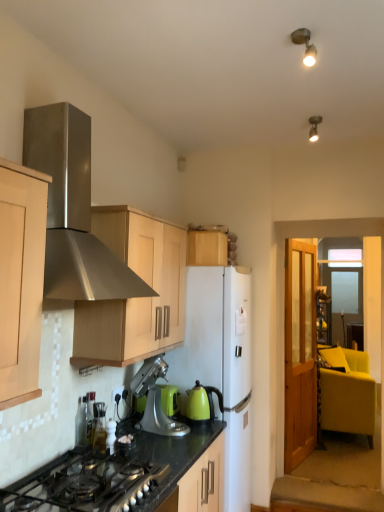
Find the location of a particular element. This screenshot has width=384, height=512. black matte gas stove at lower left is located at coordinates (84, 484).

I want to click on matte yellow armchair at right, so click(x=348, y=393).

Describe the element at coordinates (169, 399) in the screenshot. I see `green plastic kettle at center, which is the first appliance from right to left` at that location.

This screenshot has height=512, width=384. Describe the element at coordinates (206, 248) in the screenshot. I see `light wood cabinet at upper center, the 2th cabinetry in the left-to-right sequence` at that location.

Locate an element on the screen. The width and height of the screenshot is (384, 512). white matte refrigerator at center is located at coordinates (x=215, y=333).

What do you see at coordinates (99, 426) in the screenshot? This screenshot has height=512, width=384. I see `clear glass bottle at center, which ranks as the third appliance in back-to-front order` at bounding box center [99, 426].

Identify the location of black matte gas stove at lower left. Image resolution: width=384 pixels, height=512 pixels. (84, 484).

From the picture: Could you measure the distance between black granite countertop at lower center and green plastic kettle at center, which is the first appliance from right to left?

The distance of black granite countertop at lower center from green plastic kettle at center, which is the first appliance from right to left, is 23.24 inches.

In the scene shown: Is black granite countertop at lower center in contact with green plastic kettle at center, the third appliance viewed from the front?

black granite countertop at lower center is not next to green plastic kettle at center, the third appliance viewed from the front, and they're not touching.

From the image's perspective, is black granite countertop at lower center on top of green plastic kettle at center, positioned as the third appliance in left-to-right order?

No, from the image's perspective, black granite countertop at lower center is not on top of green plastic kettle at center, positioned as the third appliance in left-to-right order.

From their relative heights in the image, would you say black granite countertop at lower center is taller or shorter than green plastic kettle at center, the first appliance viewed from the back?

black granite countertop at lower center is taller than green plastic kettle at center, the first appliance viewed from the back.

From the image's perspective, which one is positioned higher, matte silver spotlight at upper center, which is the first light fixture in right-to-left order, or light wood cabinet at upper center, the 2th cabinetry in the left-to-right sequence?

A: matte silver spotlight at upper center, which is the first light fixture in right-to-left order, is shown above in the image.

Is matte silver spotlight at upper center, the second light fixture when ordered from left to right, facing towards light wood cabinet at upper center, the 2th cabinetry in the left-to-right sequence?

No, matte silver spotlight at upper center, the second light fixture when ordered from left to right, is not aimed at light wood cabinet at upper center, the 2th cabinetry in the left-to-right sequence.

In the scene shown: How different are the orientations of matte silver spotlight at upper center, the 2th light fixture positioned from the front, and light wood cabinet at upper center, the 2th cabinetry in the left-to-right sequence, in degrees?

matte silver spotlight at upper center, the 2th light fixture positioned from the front, and light wood cabinet at upper center, the 2th cabinetry in the left-to-right sequence, are facing 96.4 degrees away from each other.

Does matte silver spotlight at upper center, which is the first light fixture in right-to-left order, have a smaller size compared to light wood cabinet at upper center, marked as the first cabinetry in a right-to-left arrangement?

Correct, matte silver spotlight at upper center, which is the first light fixture in right-to-left order, occupies less space than light wood cabinet at upper center, marked as the first cabinetry in a right-to-left arrangement.

Considering the sizes of objects matte silver spotlight at upper center, the second light fixture when ordered from left to right, and metallic spot light at upper right, which is the first light fixture in front-to-back order, in the image provided, who is shorter, matte silver spotlight at upper center, the second light fixture when ordered from left to right, or metallic spot light at upper right, which is the first light fixture in front-to-back order,?

With less height is matte silver spotlight at upper center, the second light fixture when ordered from left to right.

How far apart are matte silver spotlight at upper center, the 2th light fixture positioned from the front, and metallic spot light at upper right, the 2th light fixture positioned from the right?

matte silver spotlight at upper center, the 2th light fixture positioned from the front, is 33.47 inches away from metallic spot light at upper right, the 2th light fixture positioned from the right.

From the image's perspective, would you say matte silver spotlight at upper center, the 2th light fixture positioned from the front, is shown under metallic spot light at upper right, which is the first light fixture in front-to-back order?

Indeed, from the image's perspective, matte silver spotlight at upper center, the 2th light fixture positioned from the front, is shown beneath metallic spot light at upper right, which is the first light fixture in front-to-back order.

From a real-world perspective, is matte silver spotlight at upper center, which is the first light fixture in right-to-left order, physically located above or below metallic spot light at upper right, positioned as the second light fixture in back-to-front order?

matte silver spotlight at upper center, which is the first light fixture in right-to-left order, is situated lower than metallic spot light at upper right, positioned as the second light fixture in back-to-front order, in the real world.

Starting from the black granite countertop at lower center, which appliance is the 2nd one to the left? Please provide its 2D coordinates.

[(99, 426)]

Considering the relative sizes of black granite countertop at lower center and clear glass bottle at center, acting as the first appliance starting from the front, in the image provided, is black granite countertop at lower center shorter than clear glass bottle at center, acting as the first appliance starting from the front,?

In fact, black granite countertop at lower center may be taller than clear glass bottle at center, acting as the first appliance starting from the front.

Measure the distance between black granite countertop at lower center and clear glass bottle at center, the 2th appliance viewed from the right.

The distance of black granite countertop at lower center from clear glass bottle at center, the 2th appliance viewed from the right, is 14.94 inches.

Between black granite countertop at lower center and clear glass bottle at center, which ranks as the third appliance in back-to-front order, which one has smaller width?

clear glass bottle at center, which ranks as the third appliance in back-to-front order.

Where is `countertop located in front of the matte silver spotlight at upper center, which is counted as the first light fixture, starting from the back`? Image resolution: width=384 pixels, height=512 pixels. countertop located in front of the matte silver spotlight at upper center, which is counted as the first light fixture, starting from the back is located at coordinates (129, 477).

Which object is positioned more to the right, black granite countertop at lower center or matte silver spotlight at upper center, the 2th light fixture positioned from the front?

matte silver spotlight at upper center, the 2th light fixture positioned from the front, is more to the right.

Between black granite countertop at lower center and matte silver spotlight at upper center, which is counted as the first light fixture, starting from the back, which one has smaller width?

matte silver spotlight at upper center, which is counted as the first light fixture, starting from the back.

Is black granite countertop at lower center touching matte silver spotlight at upper center, the second light fixture when ordered from left to right?

No, black granite countertop at lower center is not beside matte silver spotlight at upper center, the second light fixture when ordered from left to right.

Locate an element on the screen. the 1st appliance positioned below the stainless steel range hood at upper left (from the image's perspective) is located at coordinates (83, 423).

Can you confirm if stainless steel range hood at upper left is positioned to the left of brushed metal toaster at lower left, marked as the 1th appliance in a left-to-right arrangement?

No, stainless steel range hood at upper left is not to the left of brushed metal toaster at lower left, marked as the 1th appliance in a left-to-right arrangement.

Considering the points (72, 243) and (79, 438), which point is in front, point (72, 243) or point (79, 438)?

The point (72, 243) is in front.

You are a GUI agent. You are given a task and a screenshot of the screen. Output one action in this format:
    pyautogui.click(x=<x>, y=<y>)
    Task: Click on the 1st cabinetry to the right of the stainless steel range hood at upper left, counting from the anchor's position
    
    Given the screenshot: What is the action you would take?
    pyautogui.click(x=134, y=298)

Looking at this image, considering the relative positions of stainless steel range hood at upper left and light wood cabinet at upper center, the second cabinetry in the right-to-left sequence, in the image provided, is stainless steel range hood at upper left to the left of light wood cabinet at upper center, the second cabinetry in the right-to-left sequence, from the viewer's perspective?

Indeed, stainless steel range hood at upper left is positioned on the left side of light wood cabinet at upper center, the second cabinetry in the right-to-left sequence.

How many degrees apart are the facing directions of stainless steel range hood at upper left and light wood cabinet at upper center, the 1th cabinetry positioned from the left?

0.315 degrees separate the facing orientations of stainless steel range hood at upper left and light wood cabinet at upper center, the 1th cabinetry positioned from the left.

From the image's perspective, is stainless steel range hood at upper left located beneath light wood cabinet at upper center, the second cabinetry in the right-to-left sequence?

No.

There is a black granite countertop at lower center. Identify the location of the 1st appliance above it (from a real-world perspective). This screenshot has width=384, height=512. (169, 399).

The height and width of the screenshot is (512, 384). Find the location of `the 1st light fixture in front of the light wood cabinet at upper center, the 2th cabinetry in the left-to-right sequence, counting from the anchor's position`. the 1st light fixture in front of the light wood cabinet at upper center, the 2th cabinetry in the left-to-right sequence, counting from the anchor's position is located at coordinates (314, 128).

Estimate the real-world distances between objects in this image. Which object is closer to light wood cabinet at upper center, marked as the first cabinetry in a right-to-left arrangement, black granite countertop at lower center or matte yellow armchair at right?

black granite countertop at lower center is closer to light wood cabinet at upper center, marked as the first cabinetry in a right-to-left arrangement.

Which object lies further to the anchor point matte yellow armchair at right, green plastic kettle at center, which is the first appliance from right to left, or stainless steel range hood at upper left?

Among the two, stainless steel range hood at upper left is located further to matte yellow armchair at right.

Looking at the image, which one is located further to green plastic kettle at center, positioned as the third appliance in left-to-right order, green matte kettle at center, the 1th kitchen appliance in the right-to-left sequence, or silver metallic stand mixer at center, marked as the 1th kitchen appliance in a left-to-right arrangement?

Based on the image, green matte kettle at center, the 1th kitchen appliance in the right-to-left sequence, appears to be further to green plastic kettle at center, positioned as the third appliance in left-to-right order.

From the image, which object appears to be farther from matte yellow armchair at right, matte silver spotlight at upper center, which is the first light fixture in right-to-left order, or black matte gas stove at lower left?

black matte gas stove at lower left.

Looking at this image, when comparing their distances from white matte refrigerator at center, does green plastic kettle at center, which is the first appliance from right to left, or silver metallic stand mixer at center, the second kitchen appliance in the right-to-left sequence, seem further?

Answer: Based on the image, green plastic kettle at center, which is the first appliance from right to left, appears to be further to white matte refrigerator at center.

Estimate the real-world distances between objects in this image. Which object is further from clear glass bottle at center, which ranks as the third appliance in back-to-front order, metallic spot light at upper right, the 1th light fixture viewed from the left, or brushed metal toaster at lower left, marked as the 1th appliance in a left-to-right arrangement?

Based on the image, metallic spot light at upper right, the 1th light fixture viewed from the left, appears to be further to clear glass bottle at center, which ranks as the third appliance in back-to-front order.

Looking at the image, which one is located closer to stainless steel range hood at upper left, white matte refrigerator at center or metallic spot light at upper right, which is the first light fixture in front-to-back order?

white matte refrigerator at center is positioned closer to the anchor stainless steel range hood at upper left.

Estimate the real-world distances between objects in this image. Which object is further from green plastic kettle at center, the third appliance viewed from the front, green matte kettle at center, the 1th kitchen appliance in the right-to-left sequence, or light wood cabinet at upper center, marked as the first cabinetry in a right-to-left arrangement?

Based on the image, light wood cabinet at upper center, marked as the first cabinetry in a right-to-left arrangement, appears to be further to green plastic kettle at center, the third appliance viewed from the front.

Identify the location of kitchen appliance between matte silver spotlight at upper center, which is the first light fixture in right-to-left order, and clear glass bottle at center, acting as the first appliance starting from the front, vertically. This screenshot has height=512, width=384. (x=155, y=399).

This screenshot has height=512, width=384. Identify the location of cabinetry between silver metallic stand mixer at center, the second kitchen appliance in the right-to-left sequence, and matte yellow armchair at right, in the horizontal direction. (206, 248).

At what (x,y) coordinates should I click in order to perform the action: click on appliance between light wood cabinet at upper center, the 1th cabinetry positioned from the left, and matte yellow armchair at right, in the horizontal direction. Please return your answer as a coordinate pair (x, y). Looking at the image, I should click on (169, 399).

This screenshot has height=512, width=384. I want to click on countertop between brushed metal toaster at lower left, marked as the 1th appliance in a left-to-right arrangement, and matte yellow armchair at right, so click(129, 477).